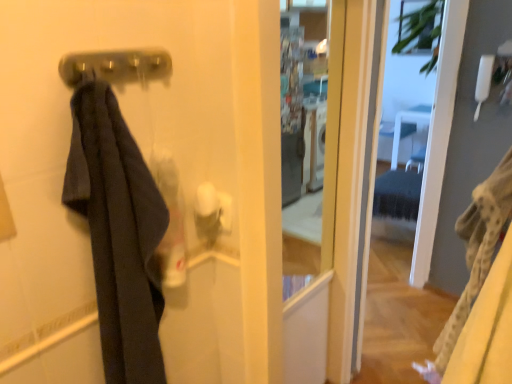
In order to face transparent glass screen door at center, should I rotate leftwards or rightwards?

You should look right and rotate roughly 18.972 degrees.

Where is `dark fabric towel at left`? This screenshot has width=512, height=384. dark fabric towel at left is located at coordinates (118, 233).

The image size is (512, 384). What do you see at coordinates (115, 66) in the screenshot? I see `metallic silver door handle at upper center` at bounding box center [115, 66].

Where is `transparent glass screen door at center`? This screenshot has width=512, height=384. transparent glass screen door at center is located at coordinates (401, 138).

From a real-world perspective, is dark fabric towel at left physically located above or below transparent glass screen door at center?

From a real-world perspective, dark fabric towel at left is physically above transparent glass screen door at center.

Which is behind, point (121, 268) or point (394, 172)?

The point (394, 172) is more distant.

Which of these two, dark fabric towel at left or transparent glass screen door at center, stands taller?

With more height is transparent glass screen door at center.

From the image's perspective, is dark fabric towel at left over transparent glass screen door at center?

Incorrect, from the image's perspective, dark fabric towel at left is lower than transparent glass screen door at center.

At what (x,y) coordinates should I click in order to perform the action: click on screen door on the right side of metallic silver door handle at upper center. Please return your answer as a coordinate pair (x, y). Looking at the image, I should click on (401, 138).

Between metallic silver door handle at upper center and transparent glass screen door at center, which one has larger width?

transparent glass screen door at center is wider.

Does metallic silver door handle at upper center come behind transparent glass screen door at center?

No, metallic silver door handle at upper center is closer to the camera.

From the picture: Which point is more forward, (106, 64) or (395, 149)?

Point (106, 64)

Which object is thinner, transparent glass screen door at center or metallic silver door handle at upper center?

Thinner between the two is metallic silver door handle at upper center.

From the image's perspective, is transparent glass screen door at center positioned above or below metallic silver door handle at upper center?

transparent glass screen door at center is below metallic silver door handle at upper center.

From a real-world perspective, who is located lower, transparent glass screen door at center or metallic silver door handle at upper center?

transparent glass screen door at center is physically lower.

Would you say transparent glass screen door at center is inside or outside metallic silver door handle at upper center?

transparent glass screen door at center is outside metallic silver door handle at upper center.

In the scene shown: Is transparent glass screen door at center inside the boundaries of dark fabric towel at left, or outside?

The correct answer is: outside.

Which point is more forward, (394, 5) or (116, 214)?

The point (116, 214) is in front.

Is transparent glass screen door at center placed right next to dark fabric towel at left?

No, transparent glass screen door at center is not touching dark fabric towel at left.

Which of these two, transparent glass screen door at center or dark fabric towel at left, is smaller?

With smaller size is dark fabric towel at left.

Which object is thinner, dark fabric towel at left or metallic silver door handle at upper center?

metallic silver door handle at upper center.

Is dark fabric towel at left aimed at metallic silver door handle at upper center?

No, dark fabric towel at left is not facing towards metallic silver door handle at upper center.

Between dark fabric towel at left and metallic silver door handle at upper center, which one has larger size?

With larger size is dark fabric towel at left.

Which is correct: metallic silver door handle at upper center is inside dark fabric towel at left, or outside of it?

metallic silver door handle at upper center is inside dark fabric towel at left.

Based on the photo, from a real-world perspective, is metallic silver door handle at upper center under dark fabric towel at left?

Actually, metallic silver door handle at upper center is physically above dark fabric towel at left in the real world.

From the image's perspective, would you say metallic silver door handle at upper center is shown under dark fabric towel at left?

No, from the image's perspective, metallic silver door handle at upper center is not below dark fabric towel at left.

Based on the photo, can you see metallic silver door handle at upper center touching dark fabric towel at left?

There is a gap between metallic silver door handle at upper center and dark fabric towel at left.

The width and height of the screenshot is (512, 384). In order to click on clothing in front of the transparent glass screen door at center in this screenshot , I will do `click(118, 233)`.

Where is `screen door behind the metallic silver door handle at upper center`? The width and height of the screenshot is (512, 384). screen door behind the metallic silver door handle at upper center is located at coordinates (401, 138).

Looking at the image, which one is located further to metallic silver door handle at upper center, dark fabric towel at left or transparent glass screen door at center?

transparent glass screen door at center lies further to metallic silver door handle at upper center than the other object.

Which object lies nearer to the anchor point metallic silver door handle at upper center, transparent glass screen door at center or dark fabric towel at left?

dark fabric towel at left is positioned closer to the anchor metallic silver door handle at upper center.

Considering their positions, is metallic silver door handle at upper center positioned further to transparent glass screen door at center than dark fabric towel at left?

metallic silver door handle at upper center lies further to transparent glass screen door at center than the other object.

Estimate the real-world distances between objects in this image. Which object is closer to dark fabric towel at left, metallic silver door handle at upper center or transparent glass screen door at center?

metallic silver door handle at upper center lies closer to dark fabric towel at left than the other object.

From the image, which object appears to be nearer to dark fabric towel at left, transparent glass screen door at center or metallic silver door handle at upper center?

metallic silver door handle at upper center.

Based on their spatial positions, is dark fabric towel at left or metallic silver door handle at upper center closer to transparent glass screen door at center?

dark fabric towel at left is closer to transparent glass screen door at center.

Locate an element on the screen. Image resolution: width=512 pixels, height=384 pixels. clothing between metallic silver door handle at upper center and transparent glass screen door at center in the horizontal direction is located at coordinates (118, 233).